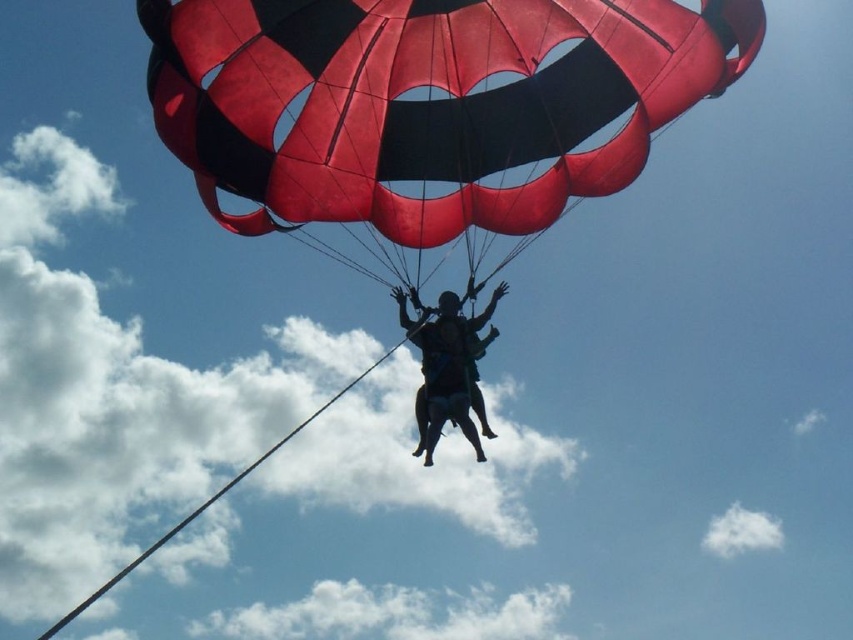
Is red/black parachute at upper center to the left of black matte parachute at center from the viewer's perspective?

In fact, red/black parachute at upper center is to the right of black matte parachute at center.

Does red/black parachute at upper center have a greater height compared to black matte parachute at center?

Yes.

Identify the location of red/black parachute at upper center. The image size is (853, 640). (428, 102).